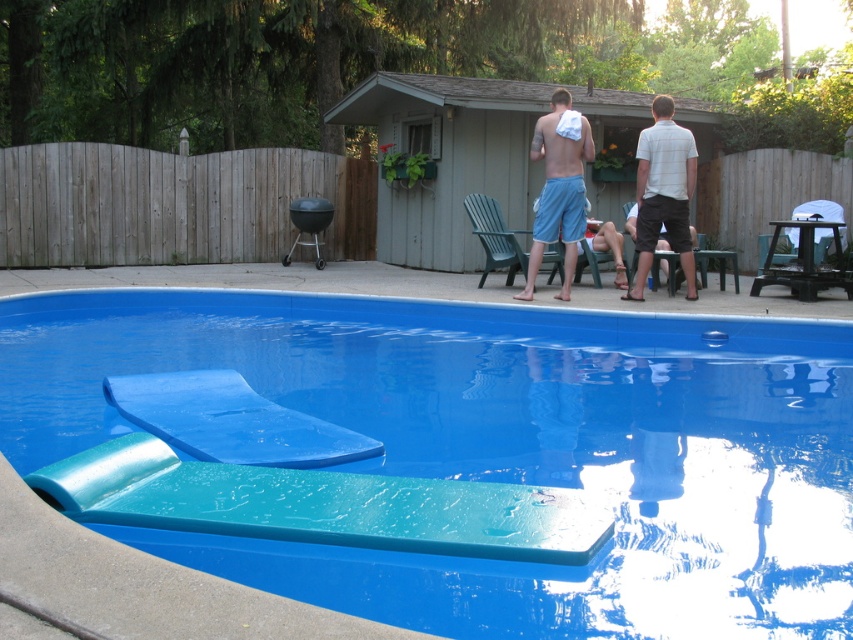
You are standing in the backyard looking at the swimming pool. There are two points marked in the image. Which point, point (160, 413) or point (641, 212), is closer to you?

Point (160, 413) is closer to the viewer than point (641, 212).

From the picture: You are standing at the edge of the swimming pool and see two points marked in the scene. According to their coordinates, which point is closer to you? The points are labeled as point 1 at [628,522] and point 2 at [344,461].

Point 1 at [628,522] is in front of point 2 at [344,461], so it is closer to you.